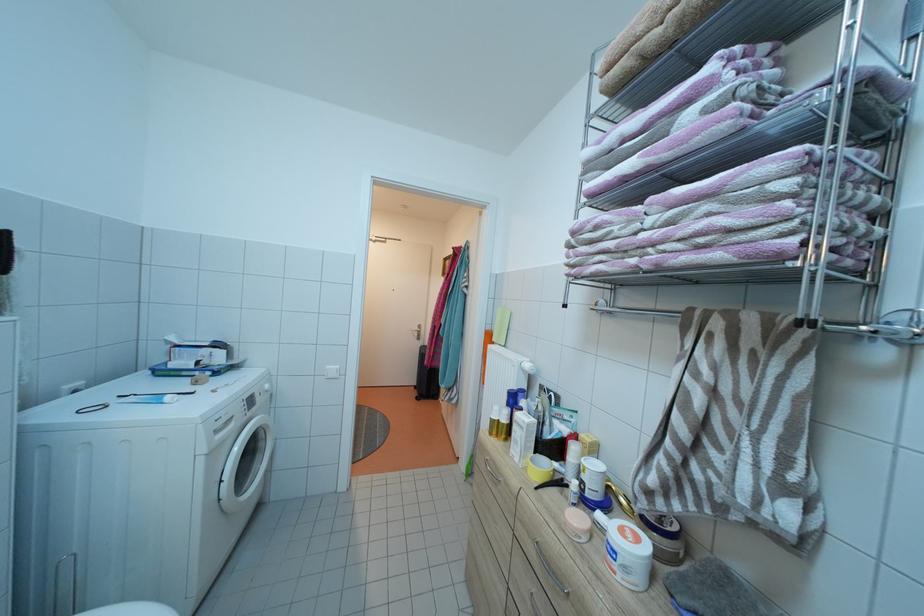
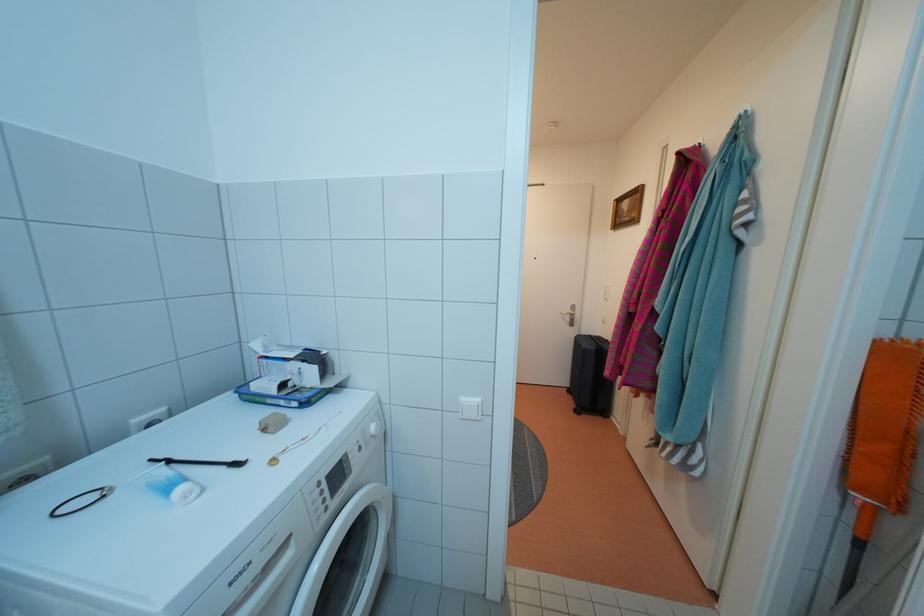
Question: The camera is either moving clockwise (left) or counter-clockwise (right) around the object. The first image is from the beginning of the video and the second image is from the end. Is the camera moving left or right when shooting the video?

Choices:
 (A) Left
 (B) Right

Answer: (B)